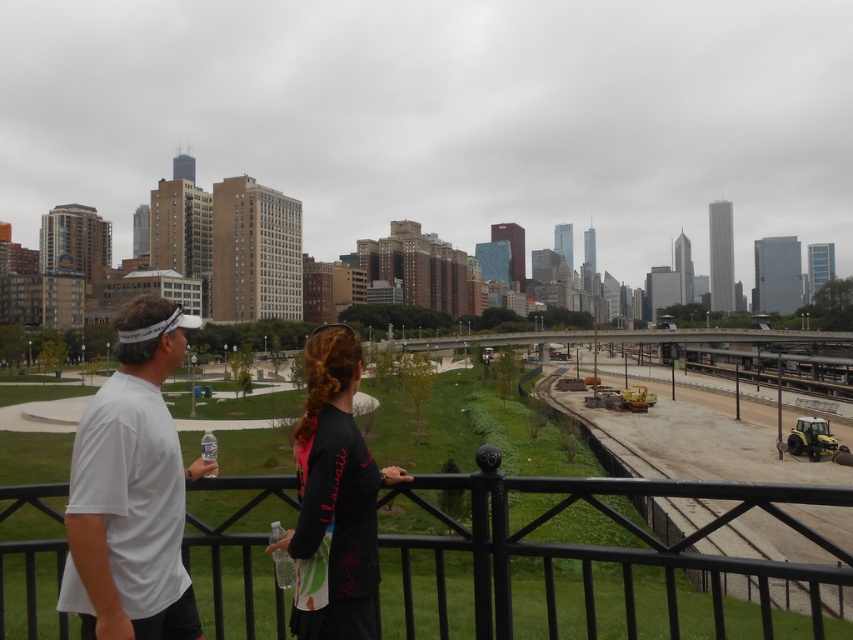
You are a delivery robot with a 1.5 meter wide package. You need to move between the white matte shirt at left and the black matte shirt at center to deliver it. Is there enough space for the package to fit through?

The white matte shirt at left is 1.70 meters from the black matte shirt at center, so yes, the package can fit through the space between them since it is wider than the package.

You are a photographer standing at the elevated walkway. You want to take a photo of both the white matte shirt at left and the black matte shirt at center. Which person should you focus on first to ensure both are in clear focus?

The white matte shirt at left is closer to the viewer than the black matte shirt at center, so you should focus on the white matte shirt at left first to ensure both are in clear focus.

You are a delivery drone with a wingspan of 1.2 meters. You need to fly from the black metal fence at lower center to the black matte shirt at center. Is there enough space between them for your wingspan?

The distance between the black metal fence at lower center and the black matte shirt at center is 13.30 meters, which is more than enough for the drone with a 1.2 meter wingspan to fly through safely.